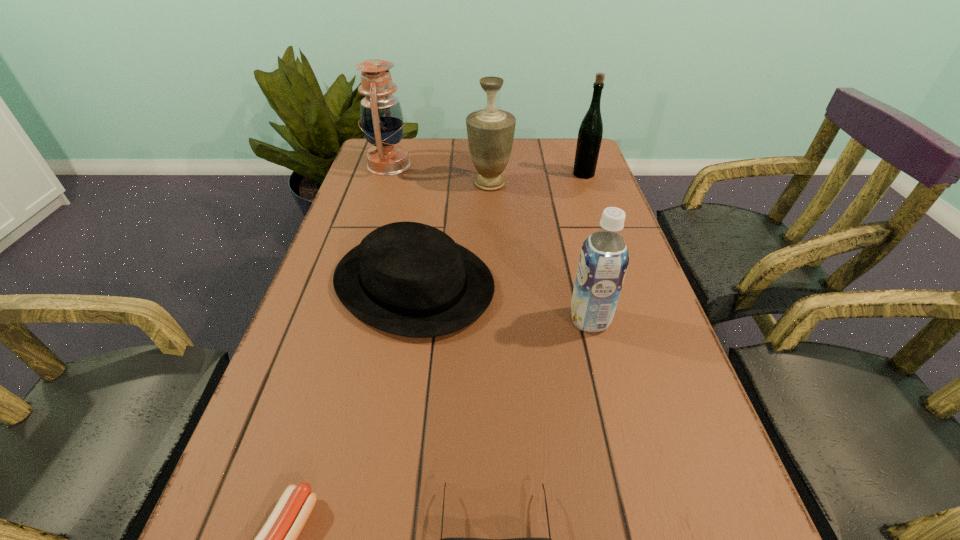
Image resolution: width=960 pixels, height=540 pixels. I want to click on oil lamp, so click(x=381, y=116).

The image size is (960, 540). I want to click on urn, so click(490, 131).

Find the location of a particular element. The height and width of the screenshot is (540, 960). the rightmost object is located at coordinates (590, 133).

Find the location of `soya milk`. soya milk is located at coordinates (604, 257).

Locate an element on the screen. fedora is located at coordinates (410, 279).

Image resolution: width=960 pixels, height=540 pixels. In order to click on vacant point located 0.090m on the right of the oil lamp in this screenshot , I will do `click(440, 165)`.

In order to click on vacant area located on the front of the urn in this screenshot , I will do `click(492, 231)`.

Image resolution: width=960 pixels, height=540 pixels. Find the location of `vacant point located 0.180m on the front of the beer bottle`. vacant point located 0.180m on the front of the beer bottle is located at coordinates (598, 214).

You are a GUI agent. You are given a task and a screenshot of the screen. Output one action in this format:
    pyautogui.click(x=<x>, y=<y>)
    Task: Click on the vacant position located on the label of the sixth object from left to right
    
    Given the screenshot: What is the action you would take?
    pyautogui.click(x=423, y=320)

Where is `free space located on the label of the sixth object from left to right`? free space located on the label of the sixth object from left to right is located at coordinates (526, 320).